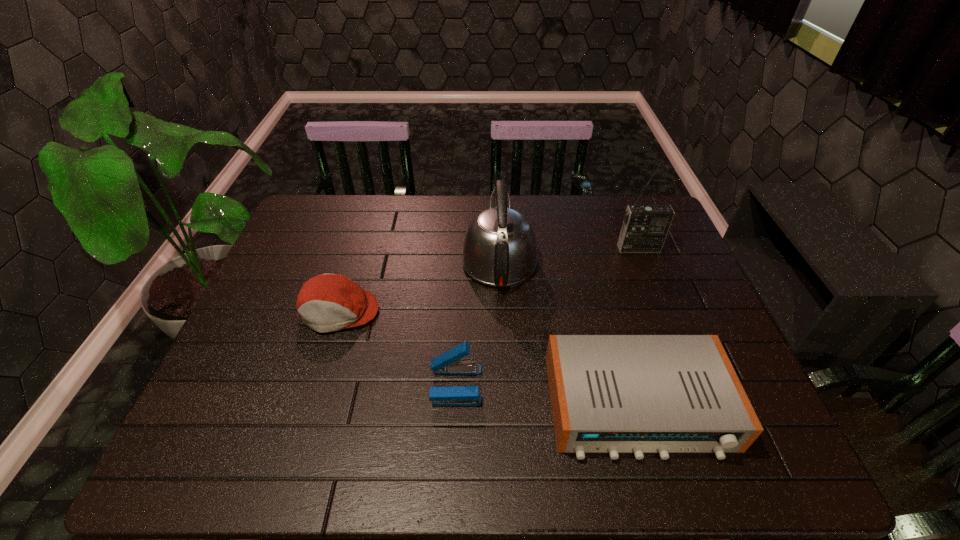
Locate an element on the screen. the farther radio receiver is located at coordinates (645, 227).

You are a GUI agent. You are given a task and a screenshot of the screen. Output one action in this format:
    pyautogui.click(x=<x>, y=<y>)
    Task: Click on the tallest object
    Image resolution: width=960 pixels, height=540 pixels.
    Given the screenshot: What is the action you would take?
    tap(645, 227)

Find the location of a particular element. This screenshot has width=960, height=540. the fourth shortest object is located at coordinates click(x=499, y=249).

At what (x,y) coordinates should I click in order to perform the action: click on the leftmost object. Please return your answer as a coordinate pair (x, y). The height and width of the screenshot is (540, 960). Looking at the image, I should click on (328, 302).

The height and width of the screenshot is (540, 960). Find the location of `stapler`. stapler is located at coordinates [449, 363].

What are the coordinates of `the nearer radio receiver` in the screenshot? It's located at (613, 394).

Image resolution: width=960 pixels, height=540 pixels. I want to click on blank area located on the display of the farther radio receiver, so point(672,330).

Find the location of a particular element. This screenshot has height=540, width=960. vacant space located on the spout of the second tallest object is located at coordinates (496, 211).

Where is `vacant space located on the spout of the second tallest object`? The width and height of the screenshot is (960, 540). vacant space located on the spout of the second tallest object is located at coordinates (496, 198).

Where is `free region located on the spout of the second tallest object`? This screenshot has width=960, height=540. free region located on the spout of the second tallest object is located at coordinates [496, 213].